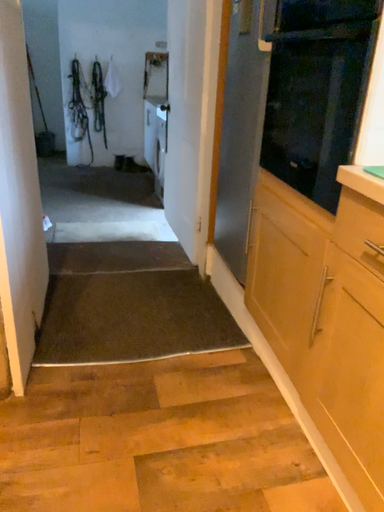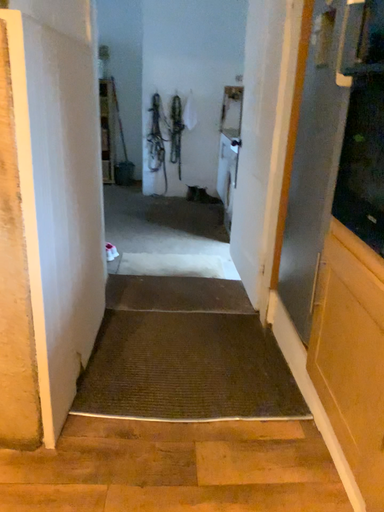
Question: Which way did the camera rotate in the video?

Choices:
 (A) rotated right
 (B) rotated left

Answer: (B)